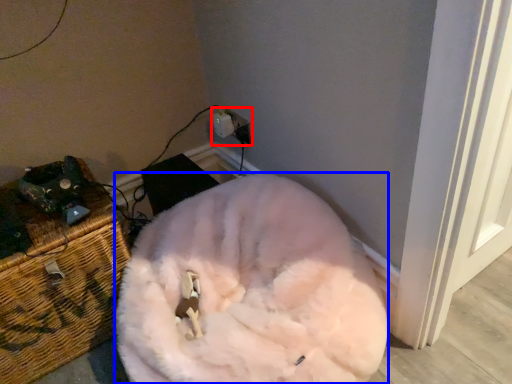
Question: Which of the following is the farthest to the observer, electric outlet (highlighted by a red box) or animal (highlighted by a blue box)?

Choices:
 (A) electric outlet
 (B) animal

Answer: (A)